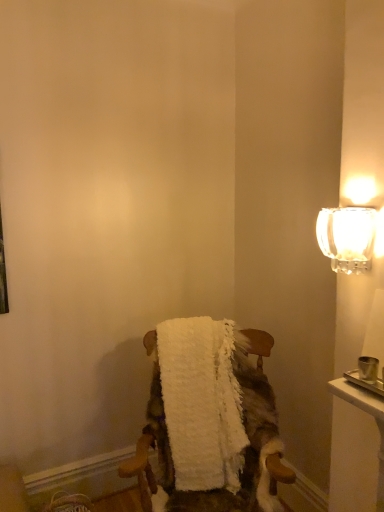
Question: Is white fluffy blanket at center touching white fluffy bath towel at center?

Choices:
 (A) yes
 (B) no

Answer: (B)

Question: From a real-world perspective, is white fluffy blanket at center located higher than white fluffy bath towel at center?

Choices:
 (A) no
 (B) yes

Answer: (A)

Question: Considering the relative positions of white fluffy blanket at center and white fluffy bath towel at center in the image provided, is white fluffy blanket at center in front of white fluffy bath towel at center?

Choices:
 (A) yes
 (B) no

Answer: (A)

Question: Is white fluffy blanket at center oriented towards white fluffy bath towel at center?

Choices:
 (A) no
 (B) yes

Answer: (A)

Question: Is white fluffy blanket at center to the right of white fluffy bath towel at center from the viewer's perspective?

Choices:
 (A) yes
 (B) no

Answer: (A)

Question: Considering the positions of white fluffy bath towel at center and clear glass sconce at upper right in the image, is white fluffy bath towel at center wider or thinner than clear glass sconce at upper right?

Choices:
 (A) thin
 (B) wide

Answer: (B)

Question: From the image's perspective, is white fluffy bath towel at center above or below clear glass sconce at upper right?

Choices:
 (A) below
 (B) above

Answer: (A)

Question: Do you think white fluffy bath towel at center is within clear glass sconce at upper right, or outside of it?

Choices:
 (A) inside
 (B) outside

Answer: (B)

Question: Is white fluffy bath towel at center taller or shorter than clear glass sconce at upper right?

Choices:
 (A) tall
 (B) short

Answer: (A)

Question: Would you say clear glass sconce at upper right is inside or outside white fluffy blanket at center?

Choices:
 (A) inside
 (B) outside

Answer: (B)

Question: Is clear glass sconce at upper right bigger or smaller than white fluffy blanket at center?

Choices:
 (A) small
 (B) big

Answer: (A)

Question: In the image, is clear glass sconce at upper right on the left side or the right side of white fluffy blanket at center?

Choices:
 (A) left
 (B) right

Answer: (B)

Question: Is clear glass sconce at upper right taller or shorter than white fluffy blanket at center?

Choices:
 (A) tall
 (B) short

Answer: (B)

Question: Would you say white fluffy bath towel at center is inside or outside white fluffy blanket at center?

Choices:
 (A) inside
 (B) outside

Answer: (A)

Question: Is white fluffy bath towel at center to the left or to the right of white fluffy blanket at center in the image?

Choices:
 (A) right
 (B) left

Answer: (B)